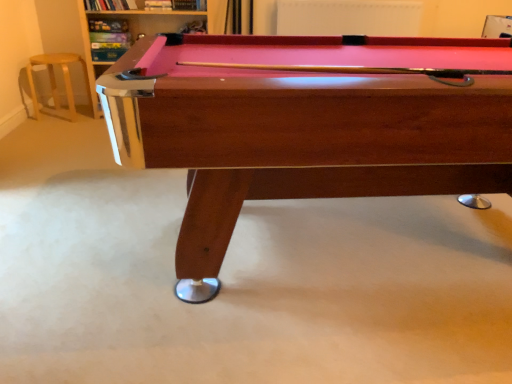
Question: In terms of height, does metallic silver pool table at upper left look taller or shorter compared to wooden billiard table at center?

Choices:
 (A) tall
 (B) short

Answer: (A)

Question: Which is correct: metallic silver pool table at upper left is inside wooden billiard table at center, or outside of it?

Choices:
 (A) outside
 (B) inside

Answer: (A)

Question: Which of these objects is positioned farthest from the metallic silver pool table at upper left?

Choices:
 (A) light wood bar stool at left
 (B) wooden billiard table at center

Answer: (B)

Question: Based on their relative distances, which object is farther from the light wood bar stool at left?

Choices:
 (A) wooden billiard table at center
 (B) metallic silver pool table at upper left

Answer: (A)